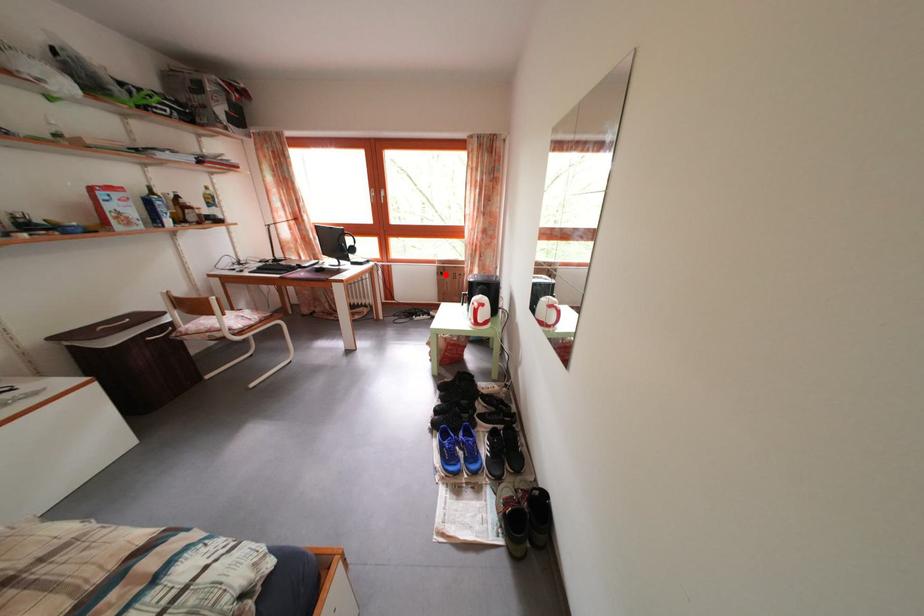
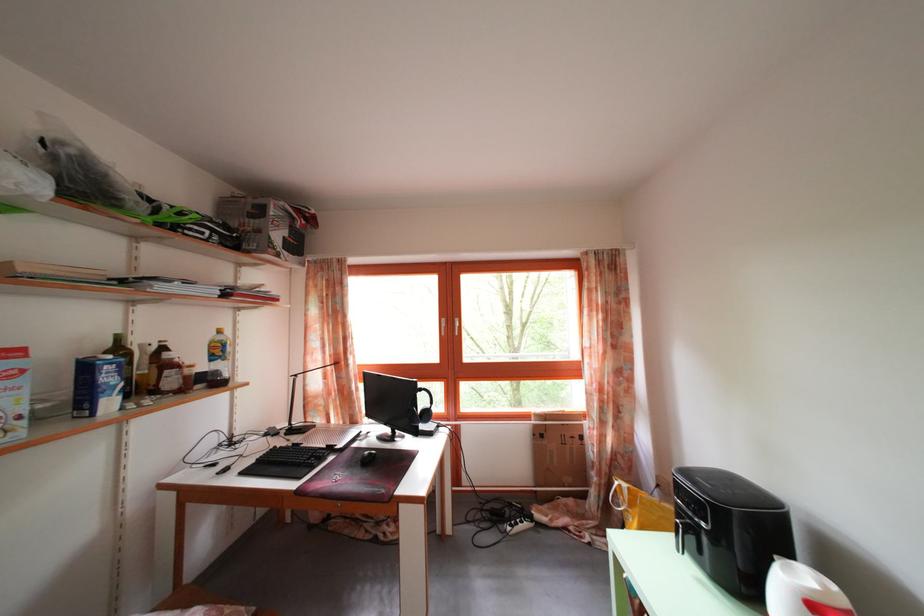
Where in the second image is the point corresponding to the highlighted location from the first image?

(542, 432)